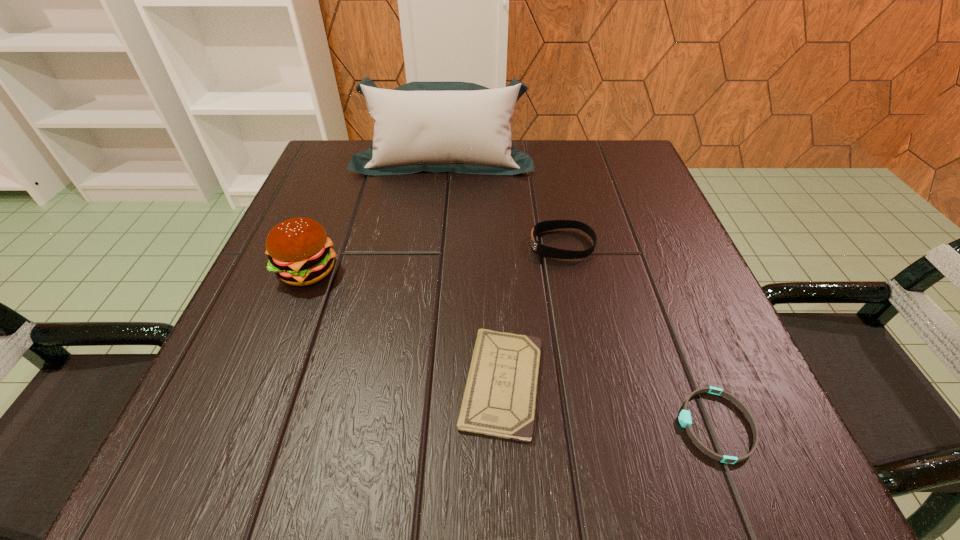
Locate an element on the screen. This screenshot has width=960, height=540. cushion at the left edge is located at coordinates (460, 127).

Find the location of a particular element. The height and width of the screenshot is (540, 960). hamburger located in the left edge section of the desktop is located at coordinates (299, 250).

The width and height of the screenshot is (960, 540). Identify the location of object present at the far left corner. (460, 127).

Locate an element on the screen. The image size is (960, 540). object that is at the near right corner is located at coordinates (685, 420).

Find the location of a particular element. The image size is (960, 540). vacant space at the far edge of the desktop is located at coordinates (414, 177).

Identify the location of free space at the near edge. This screenshot has width=960, height=540. (372, 480).

This screenshot has height=540, width=960. In the image, there is a desktop. Find the location of `free region at the left edge`. free region at the left edge is located at coordinates (344, 247).

In the image, there is a desktop. At what (x,y) coordinates should I click in order to perform the action: click on vacant space at the right edge. Please return your answer as a coordinate pair (x, y). Looking at the image, I should click on (617, 324).

In the image, there is a desktop. Identify the location of free space at the far left corner. (313, 168).

Locate an element on the screen. Image resolution: width=960 pixels, height=540 pixels. vacant space at the near right corner of the desktop is located at coordinates (673, 456).